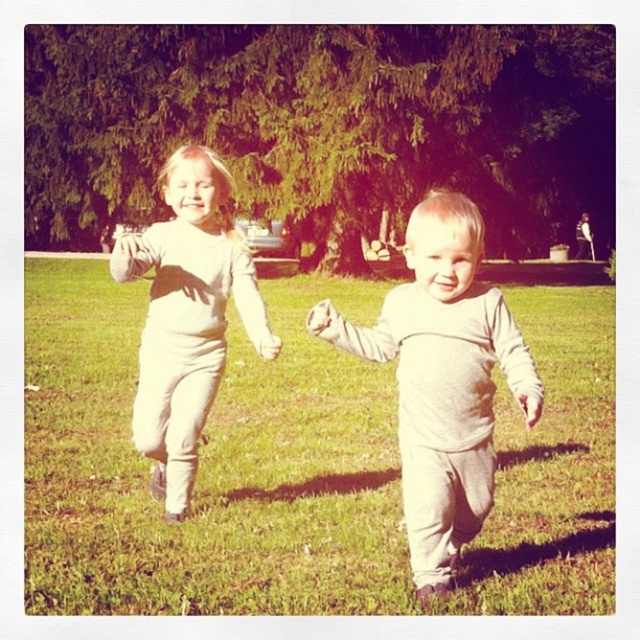
Is green grass at center smaller than gray cotton onesie at center?

Incorrect, green grass at center is not smaller in size than gray cotton onesie at center.

Identify the location of green grass at center. (209, 465).

Does point (566, 328) lie behind point (442, 205)?

Yes, point (566, 328) is farther from viewer.

I want to click on green grass at center, so click(x=209, y=465).

Is the position of gray cotton onesie at center less distant than that of white cotton shirt at upper left?

Yes, it is in front of white cotton shirt at upper left.

Can you confirm if gray cotton onesie at center is taller than white cotton shirt at upper left?

No.

Between point (470, 273) and point (195, 316), which one is positioned behind?

Positioned behind is point (195, 316).

Where is `gray cotton onesie at center`? This screenshot has height=640, width=640. gray cotton onesie at center is located at coordinates (442, 380).

Is green grass at center below white cotton shirt at upper left?

Correct, green grass at center is located below white cotton shirt at upper left.

Who is more forward, (372, 298) or (173, 195)?

Positioned in front is point (173, 195).

Between point (326, 385) and point (180, 266), which one is positioned in front?

Positioned in front is point (180, 266).

This screenshot has width=640, height=640. In order to click on green grass at center in this screenshot , I will do `click(209, 465)`.